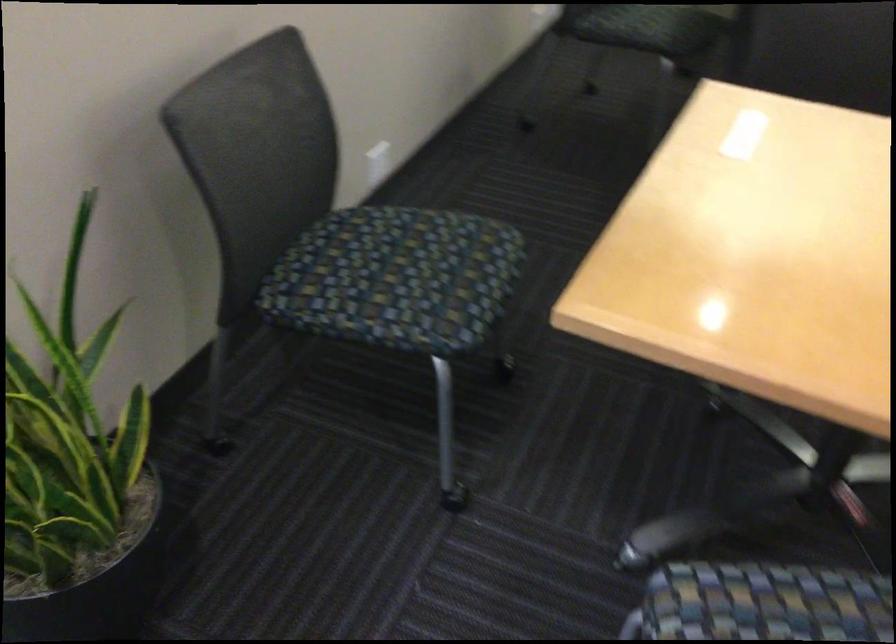
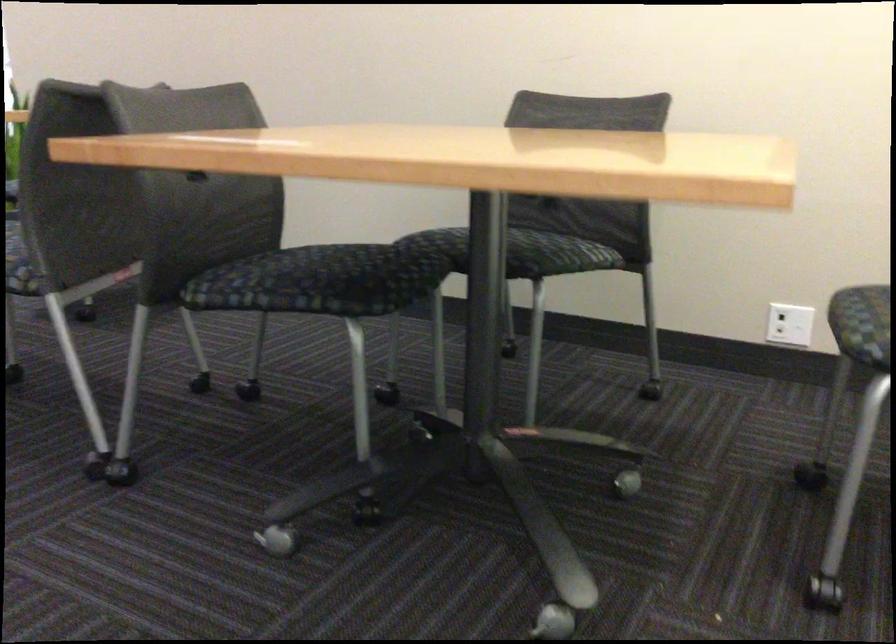
Question: I am providing you with two images of the same scene from different viewpoints. After the viewpoint changes to image2, which objects are now occluded?

Choices:
 (A) wooden goblet
 (B) chair sitting surface
 (C) electrical outlet socket
 (D) dark chair seat

Answer: (D)